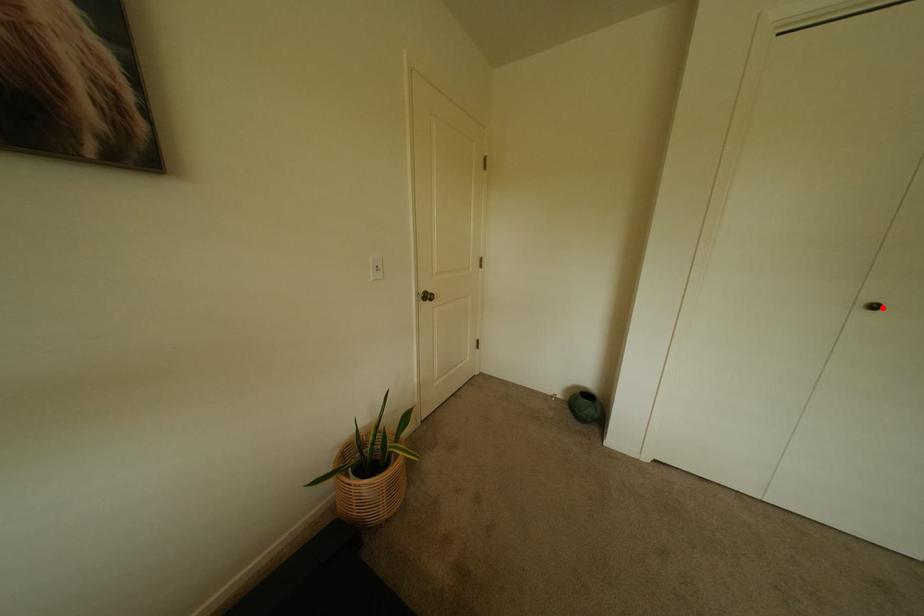
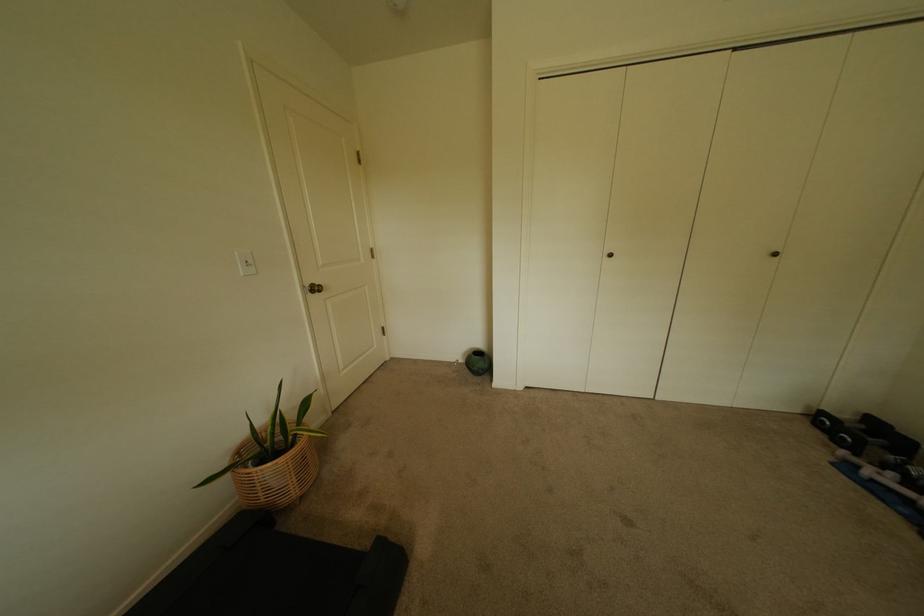
Locate, in the second image, the point that corresponds to the highlighted location in the first image.

(618, 256)